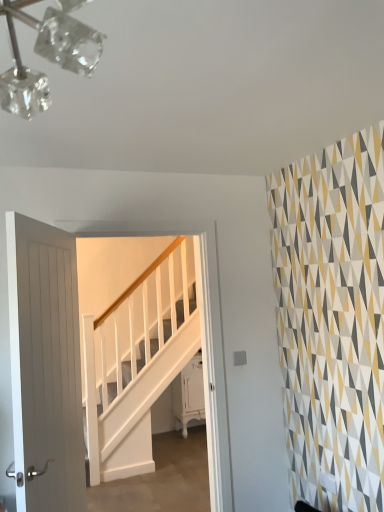
Question: From their relative heights in the image, would you say white glossy cabinet at lower center is taller or shorter than white wooden door at left?

Choices:
 (A) tall
 (B) short

Answer: (B)

Question: Does point (201, 400) appear closer or farther from the camera than point (6, 245)?

Choices:
 (A) farther
 (B) closer

Answer: (A)

Question: Which is nearer to the white glossy cabinet at lower center?

Choices:
 (A) white wooden door at left
 (B) white wooden stairs at center

Answer: (B)

Question: Which is farther from the white glossy cabinet at lower center?

Choices:
 (A) white wooden door at left
 (B) white wooden stairs at center

Answer: (A)